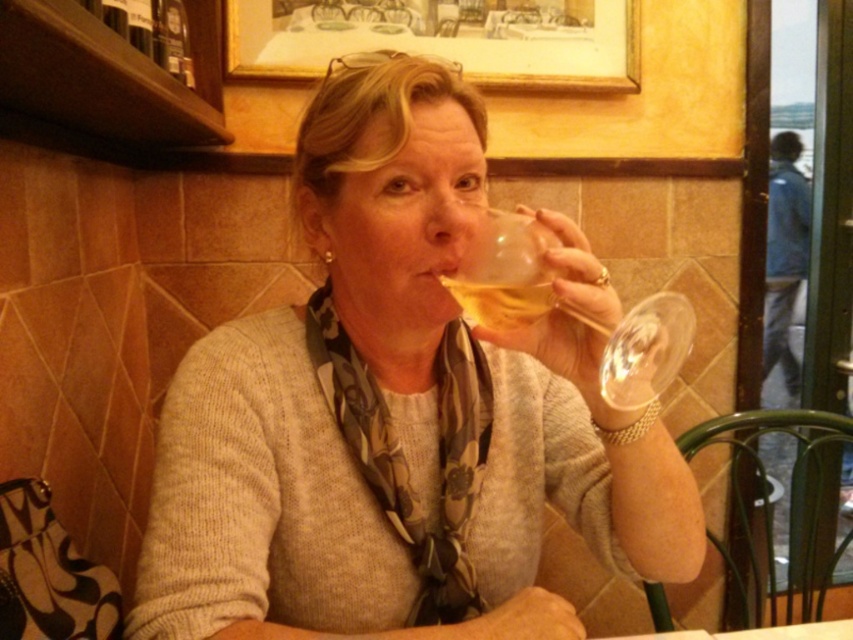
Between matte glass at center and golden translucent wine glass at upper center, which one appears on the left side from the viewer's perspective?

matte glass at center

This screenshot has height=640, width=853. I want to click on matte glass at center, so click(395, 417).

At what (x,y) coordinates should I click in order to perform the action: click on matte glass at center. Please return your answer as a coordinate pair (x, y). Looking at the image, I should click on (395, 417).

Looking at this image, does matte glass bottle at upper left appear over golden translucent wine glass at upper center?

Indeed, matte glass bottle at upper left is positioned over golden translucent wine glass at upper center.

The height and width of the screenshot is (640, 853). What do you see at coordinates (149, 29) in the screenshot?
I see `matte glass bottle at upper left` at bounding box center [149, 29].

The image size is (853, 640). Identify the location of matte glass bottle at upper left. (149, 29).

Is point (241, 42) less distant than point (173, 38)?

No.

Consider the image. How far apart are wooden frame at upper center and matte glass bottle at upper left?

wooden frame at upper center and matte glass bottle at upper left are 20.41 inches apart from each other.

Who is more forward, (599, 16) or (167, 65)?

Point (167, 65) is more forward.

Find the location of a particular element. wooden frame at upper center is located at coordinates (445, 38).